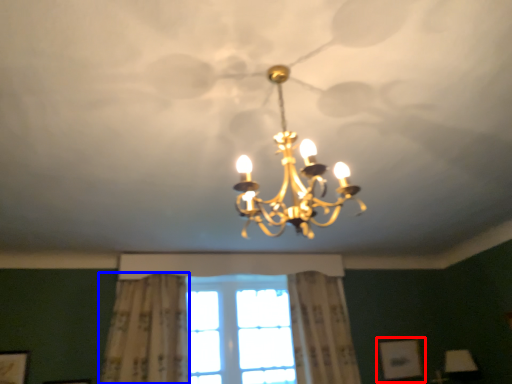
Question: Which object appears farthest to the camera in this image, picture frame (highlighted by a red box) or curtain (highlighted by a blue box)?

Choices:
 (A) picture frame
 (B) curtain

Answer: (A)